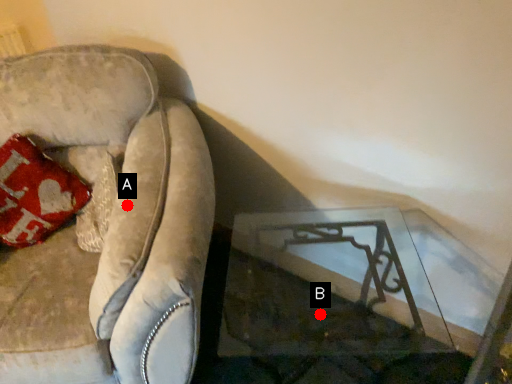
Question: Two points are circled on the image, labeled by A and B beside each circle. Which point is farther from the camera taking this photo?

Choices:
 (A) A is further
 (B) B is further

Answer: (B)